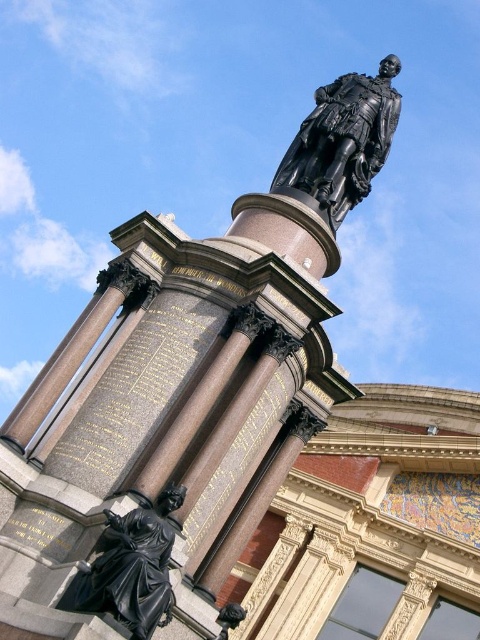
Is bronze statue at upper center positioned in front of black polished statue at lower left?

No.

Locate an element on the screen. bronze statue at upper center is located at coordinates (343, 140).

Locate an element on the screen. bronze statue at upper center is located at coordinates tap(343, 140).